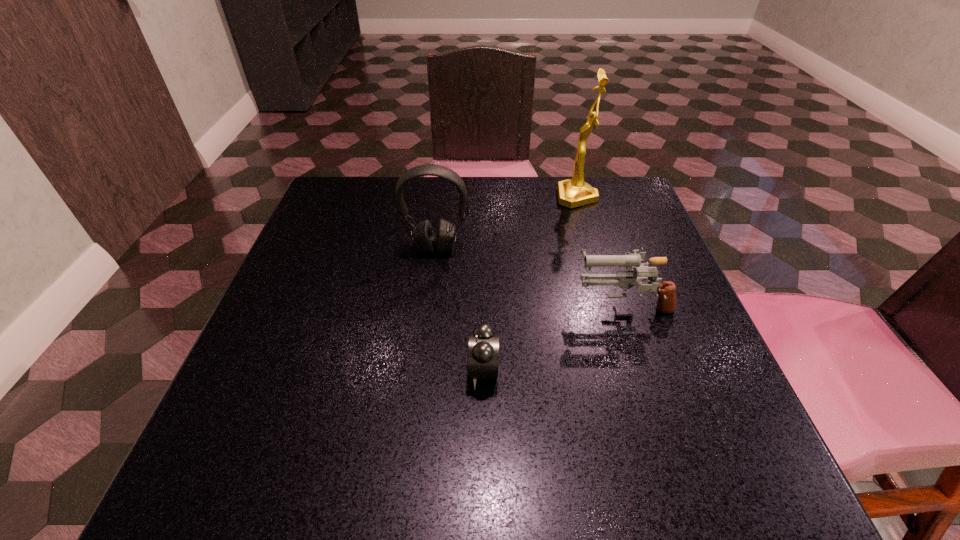
I want to click on gun that is at the right edge, so click(x=625, y=279).

This screenshot has width=960, height=540. I want to click on object at the far right corner, so click(x=572, y=193).

Identify the location of vacant region at the far edge of the desktop. (416, 221).

At what (x,y) coordinates should I click in order to perform the action: click on free space at the near edge of the desktop. Please return your answer as a coordinate pair (x, y). This screenshot has width=960, height=540. Looking at the image, I should click on (598, 461).

Where is `vacant area at the left edge`? This screenshot has width=960, height=540. vacant area at the left edge is located at coordinates (333, 334).

Identify the location of free space at the right edge. (689, 413).

Where is `vacant space at the far left corner of the desktop`? vacant space at the far left corner of the desktop is located at coordinates (383, 191).

You are a GUI agent. You are given a task and a screenshot of the screen. Output one action in this format:
    pyautogui.click(x=<x>, y=<y>)
    Task: Click on the free space at the near left corner of the desktop
    The height and width of the screenshot is (540, 960).
    Given the screenshot: What is the action you would take?
    pyautogui.click(x=205, y=437)

Locate an element on the screen. The width and height of the screenshot is (960, 540). vacant space at the far right corner of the desktop is located at coordinates (625, 218).

This screenshot has width=960, height=540. In order to click on vacant region between the second shortest object and the farthest object in this screenshot , I will do `click(600, 251)`.